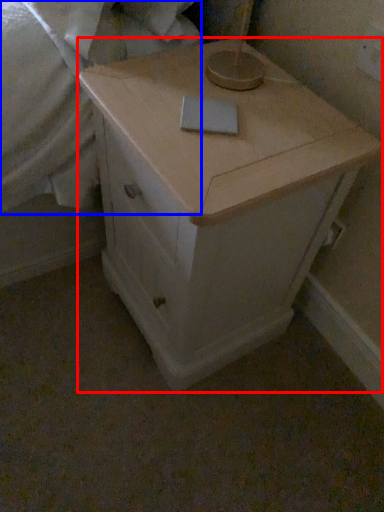
Question: Which of the following is the closest to the observer, chest of drawers (highlighted by a red box) or sheet (highlighted by a blue box)?

Choices:
 (A) chest of drawers
 (B) sheet

Answer: (A)